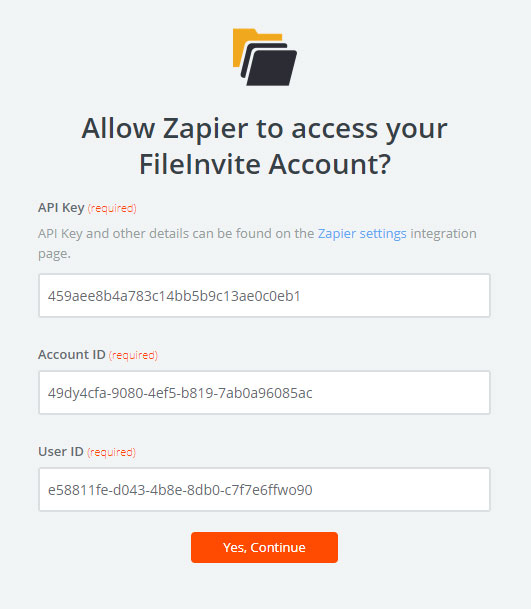
Where is `yellow file folder`? yellow file folder is located at coordinates (242, 30).